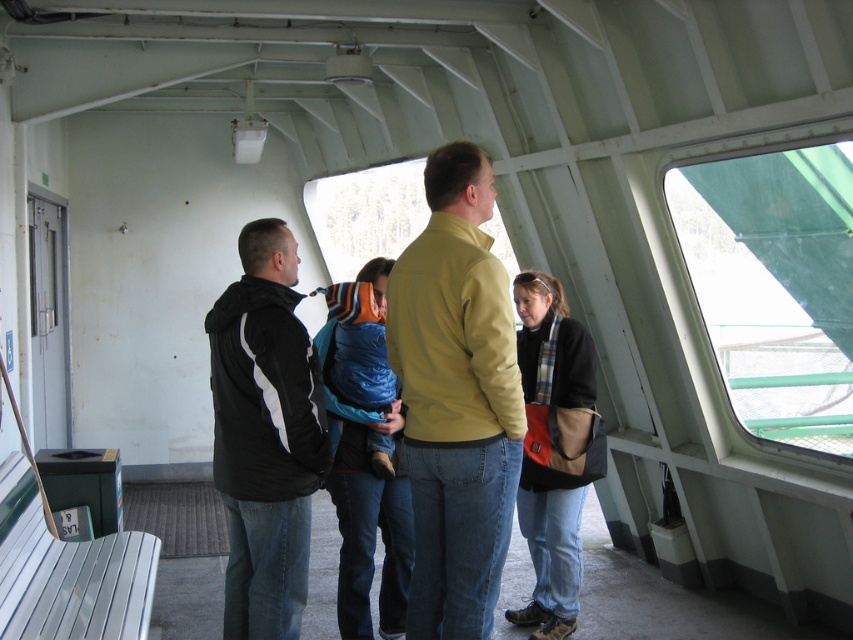
You are a tailor who needs to determine if the matte yellow jacket at center can fit into a storage box designed for the black soft fabric jacket at lower right. Based on their sizes, will it fit?

The matte yellow jacket at center might be wider than black soft fabric jacket at lower right, so there is a possibility it won not fit into the storage box designed for the black soft fabric jacket at lower right.

Based on the photo, you are a passenger on the ferry and want to see the view outside through the transparent plastic window at right. You are currently wearing the matte yellow sweater at center. Can your sweater fit through the window if you try to put your arms through it?

The matte yellow sweater at center is narrower than the transparent plastic window at right, so it could potentially fit through the window if you stretch it out. However, attempting to put your arms through the window might not be practical or safe, as windows are typically fixed and not meant for such actions.

You are a passenger on the ferry and want to see the view outside through the transparent plastic window at right while wearing the matte yellow sweater at center. Can you comfortably look out the window without needing to stand up?

The matte yellow sweater at center has a lesser height compared to transparent plastic window at right, which means the window is taller than the sweater. Since the sweater is lower, you can comfortably look out the window without needing to stand up.